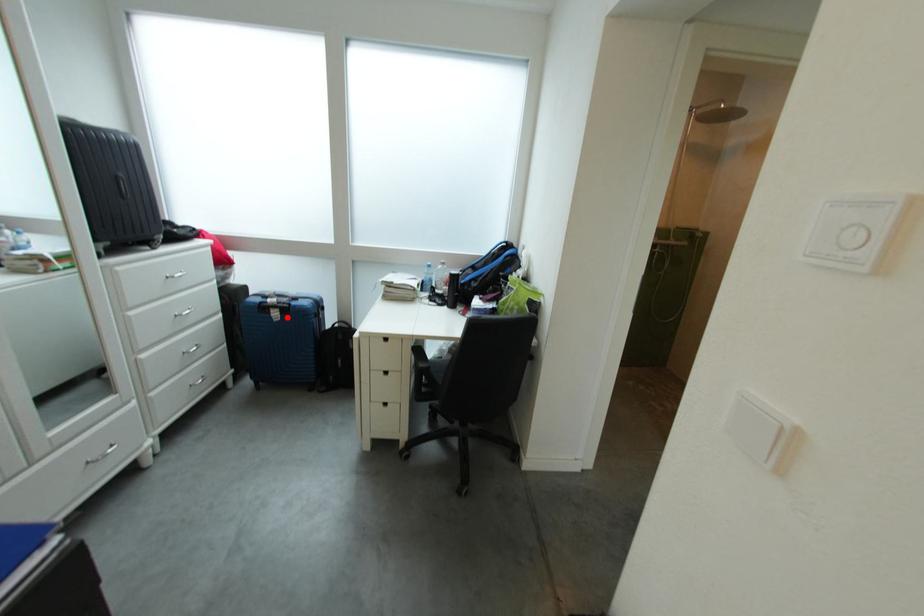
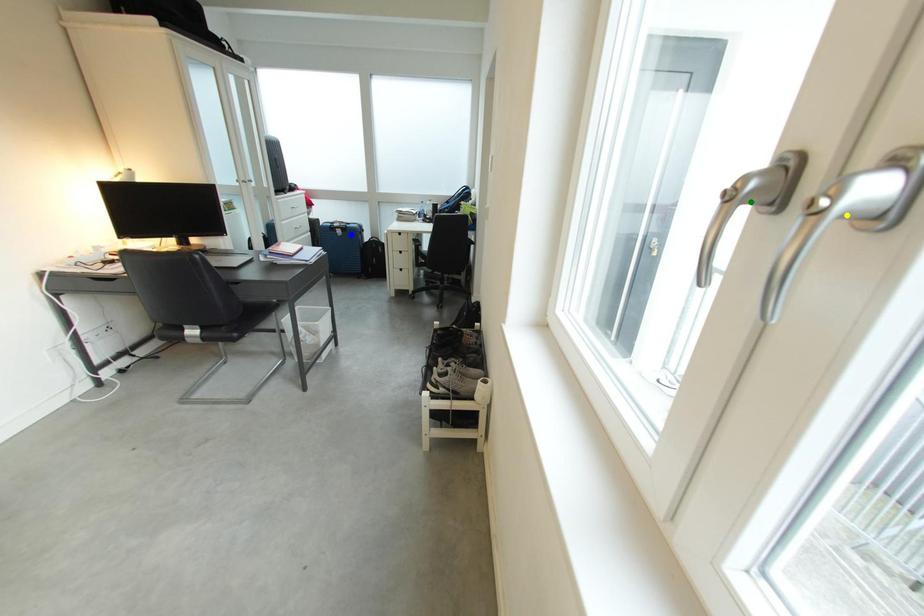
Question: I am providing you with two images of the same scene from different viewpoints. A red point is marked on the first image. You are given multiple points on the second image. In image 2, which mark is for the same physical point as the one in image 1?

Choices:
 (A) green point
 (B) yellow point
 (C) blue point

Answer: (C)